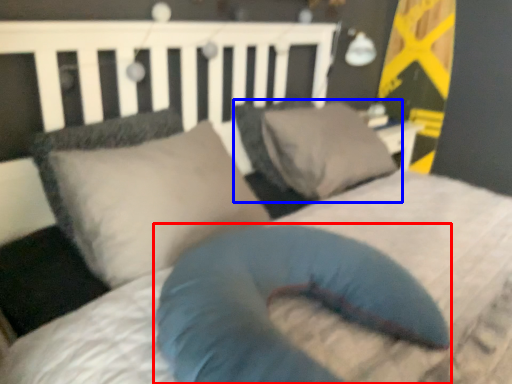
Question: Which object appears closest to the camera in this image, pillow (highlighted by a red box) or pillow (highlighted by a blue box)?

Choices:
 (A) pillow
 (B) pillow

Answer: (A)